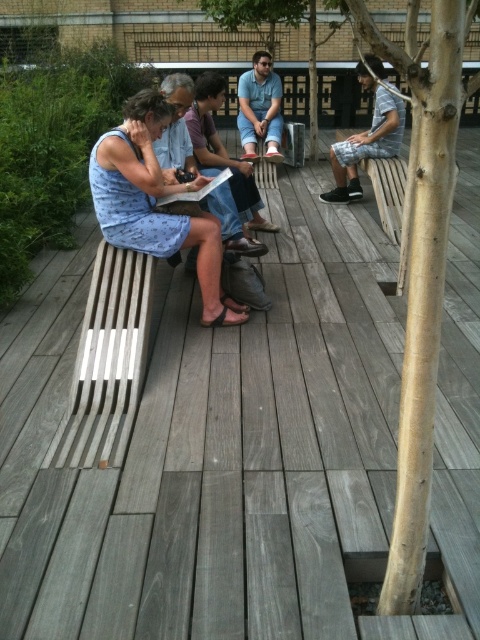
Question: Which object is the closest to the gray wood bench at left?

Choices:
 (A) denim shorts at center
 (B) blue cotton dress at center
 (C) light blue denim shorts at center
 (D) blue printed dress at left

Answer: (D)

Question: Can you confirm if gray wood bench at left is positioned below blue cotton dress at center?

Choices:
 (A) yes
 (B) no

Answer: (A)

Question: Is denim shorts at center closer to the viewer compared to blue cotton dress at center?

Choices:
 (A) yes
 (B) no

Answer: (A)

Question: From the image, what is the correct spatial relationship of blue printed dress at left in relation to denim shorts at center?

Choices:
 (A) below
 (B) above

Answer: (A)

Question: Considering the real-world distances, which object is closest to the blue cotton dress at center?

Choices:
 (A) blue printed dress at left
 (B) gray wood bench at left
 (C) light blue denim shorts at center
 (D) denim shorts at center

Answer: (C)

Question: Which object appears closest to the camera in this image?

Choices:
 (A) light blue denim shorts at center
 (B) blue cotton dress at center
 (C) denim shorts at center
 (D) blue printed dress at left

Answer: (D)